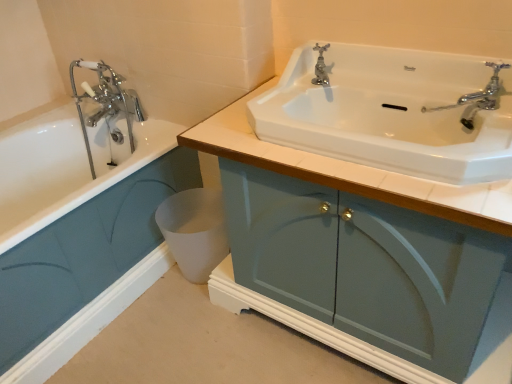
Question: Is point (82, 125) closer or farther from the camera than point (184, 263)?

Choices:
 (A) closer
 (B) farther

Answer: (B)

Question: Is matte teal cabinet at lower left, the 1th bathroom cabinet positioned from the left, in front of or behind white matte toilet bowl at lower center in the image?

Choices:
 (A) behind
 (B) front

Answer: (B)

Question: Based on their relative distances, which object is nearer to the polished chrome faucet at upper center?

Choices:
 (A) white glossy sink at upper center
 (B) matte teal cabinet at lower left, the 2th bathroom cabinet positioned from the right
 (C) matte blue cabinet at center, positioned as the 1th bathroom cabinet in right-to-left order
 (D) white matte toilet bowl at lower center

Answer: (A)

Question: Which object is positioned closest to the white matte toilet bowl at lower center?

Choices:
 (A) polished chrome faucet at upper center
 (B) white glossy sink at upper center
 (C) matte teal cabinet at lower left, the 2th bathroom cabinet positioned from the right
 (D) matte blue cabinet at center, the 2th bathroom cabinet viewed from the left

Answer: (C)